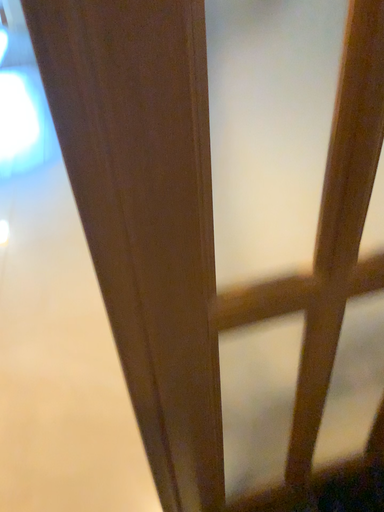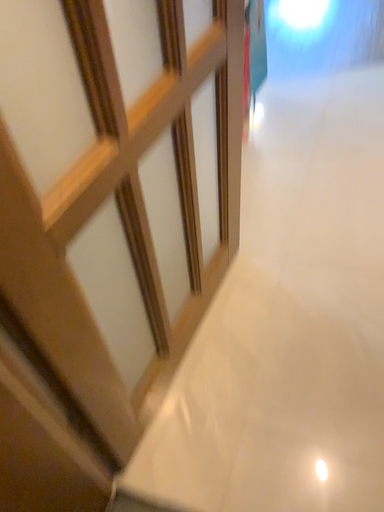
Question: How did the camera likely rotate when shooting the video?

Choices:
 (A) rotated downward
 (B) rotated upward

Answer: (A)